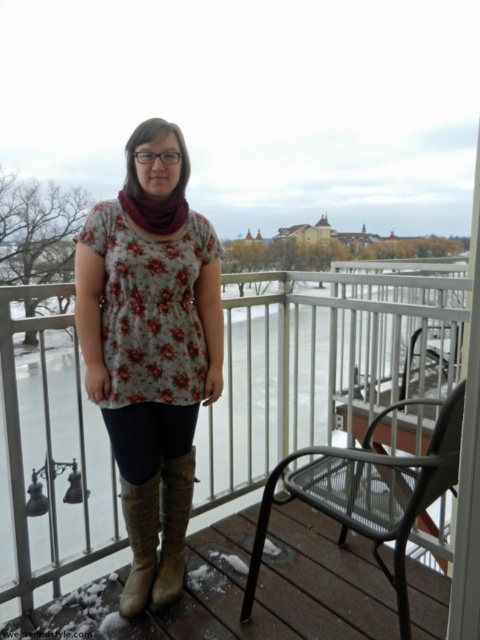
Question: Estimate the real-world distances between objects in this image. Which object is closer to the metal mesh chair at lower right?

Choices:
 (A) brown leather boots at center
 (B) purple soft scarf at center
 (C) leather boots at center

Answer: (C)

Question: Which is farther from the brown leather boots at lower center?

Choices:
 (A) floral fabric top at center
 (B) metal mesh chair at lower right
 (C) brown leather boots at center
 (D) leather boots at center

Answer: (C)

Question: Is the position of floral fabric top at center less distant than that of brown leather boots at lower center?

Choices:
 (A) no
 (B) yes

Answer: (A)

Question: Can you confirm if brown leather boots at lower center is positioned below leather boots at center?

Choices:
 (A) no
 (B) yes

Answer: (B)

Question: Is brown leather boots at center smaller than purple soft scarf at center?

Choices:
 (A) no
 (B) yes

Answer: (A)

Question: Which point is farther from the camera taking this photo?

Choices:
 (A) (147, 232)
 (B) (337, 480)
 (C) (186, 230)
 (D) (131, 570)

Answer: (D)